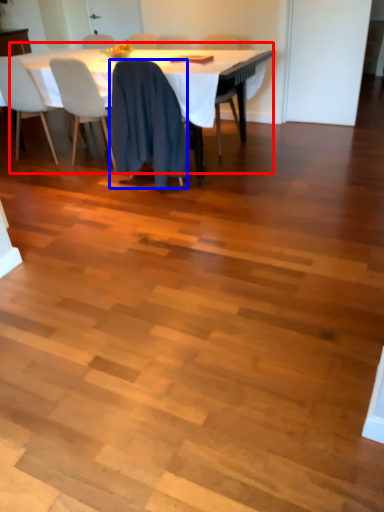
Question: Which point is further to the camera, table (highlighted by a red box) or chair (highlighted by a blue box)?

Choices:
 (A) table
 (B) chair

Answer: (A)